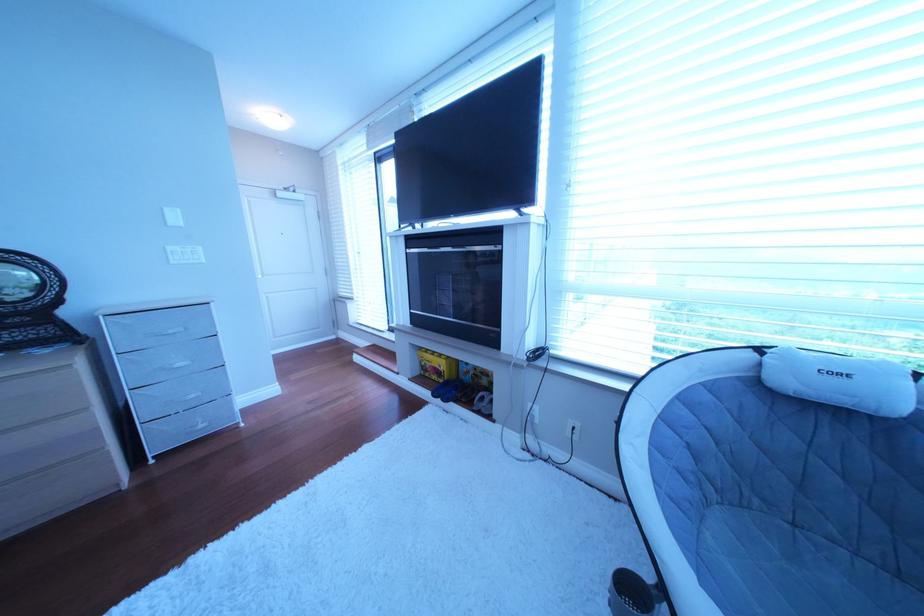
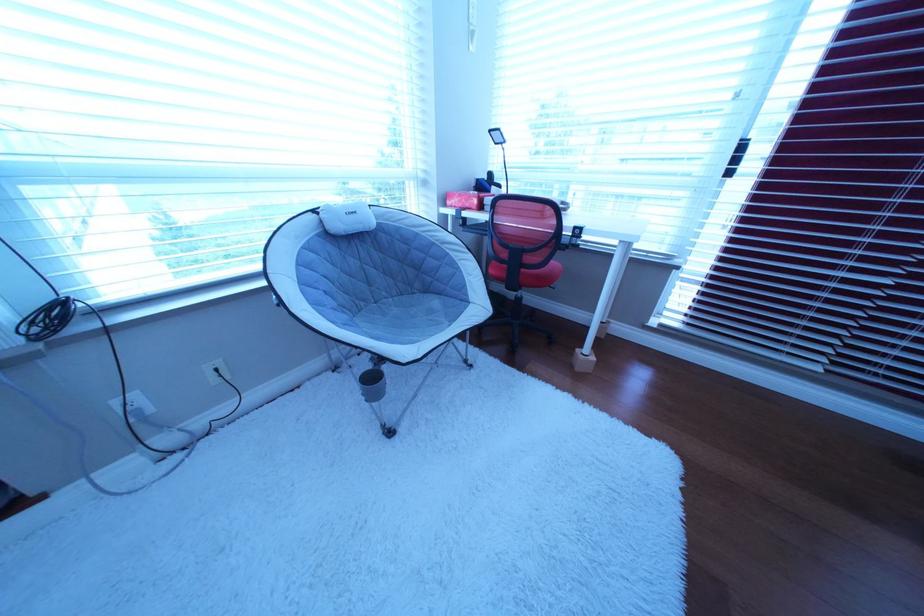
First-person continuous shooting, in which direction is the camera rotating?

The rotation direction of the camera is right-down.